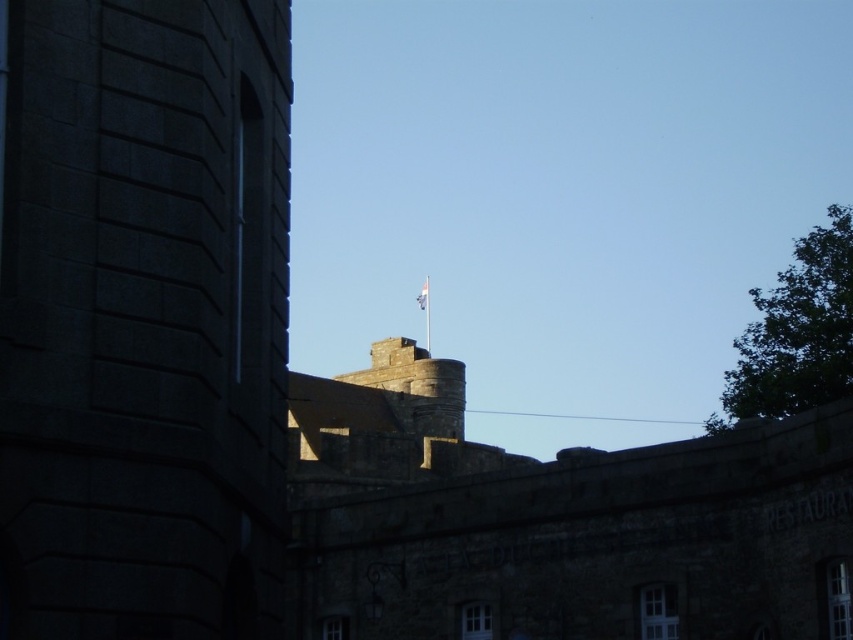
Does point (231, 330) come in front of point (422, 292)?

Yes, point (231, 330) is in front of point (422, 292).

Is point (271, 561) positioned in front of point (425, 282)?

Yes, point (271, 561) is closer to viewer.

What are the coordinates of `dark stone tower at left` in the screenshot? It's located at (143, 317).